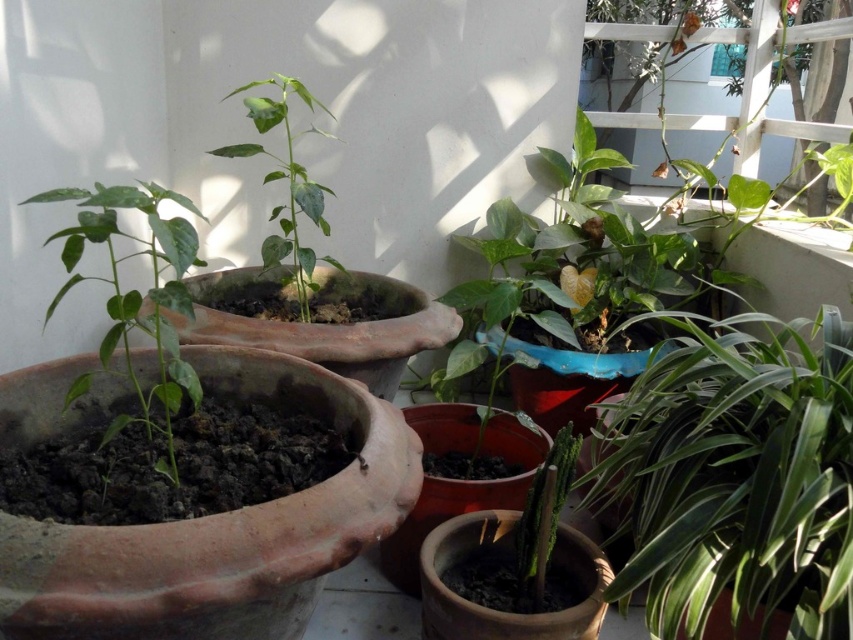
Question: Which object appears closest to the camera in this image?

Choices:
 (A) green matte plant at left
 (B) green matte plant at center

Answer: (A)

Question: Estimate the real-world distances between objects in this image. Which object is closer to the green glossy leafy plant at center-right?

Choices:
 (A) green matte plant at left
 (B) green matte plant at center

Answer: (A)

Question: Considering the relative positions of green glossy leafy plant at center-right and green matte plant at center in the image provided, where is green glossy leafy plant at center-right located with respect to green matte plant at center?

Choices:
 (A) right
 (B) left

Answer: (A)

Question: Considering the real-world distances, which object is closest to the green matte plant at center?

Choices:
 (A) green matte plant at left
 (B) green glossy leafy plant at center-right

Answer: (A)

Question: Is green glossy leafy plant at center-right closer to camera compared to green matte plant at center?

Choices:
 (A) no
 (B) yes

Answer: (B)

Question: Is green glossy leafy plant at center-right above green matte plant at left?

Choices:
 (A) no
 (B) yes

Answer: (A)